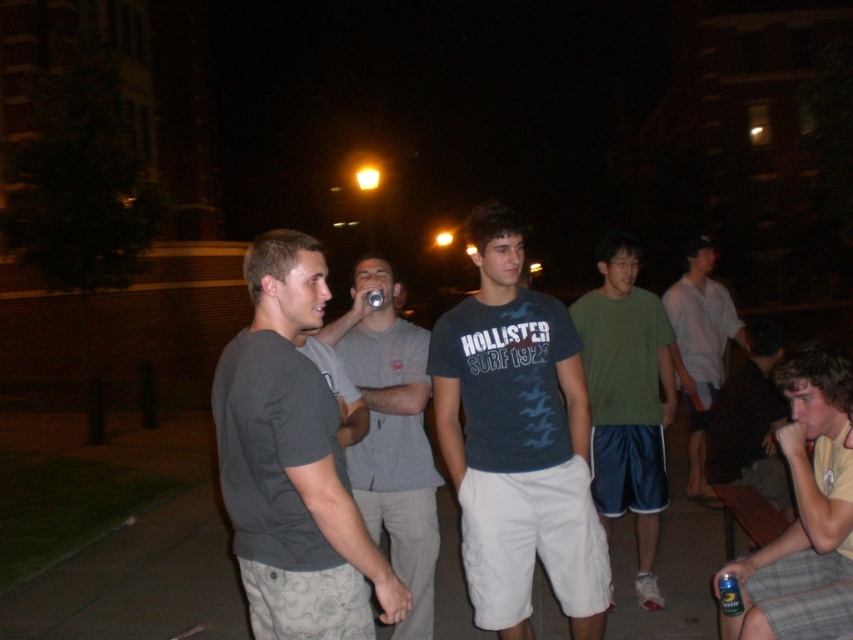
Question: Does yellow plaid shorts at lower right have a greater width compared to black striped shirt at lower right?

Choices:
 (A) yes
 (B) no

Answer: (B)

Question: Which point is closer to the camera taking this photo?

Choices:
 (A) (752, 609)
 (B) (276, 244)
 (C) (729, 337)

Answer: (B)

Question: Which object is positioned farthest from the white cotton shirt at right?

Choices:
 (A) gray cotton t-shirt at center
 (B) black striped shirt at lower right
 (C) yellow plaid shorts at lower right

Answer: (A)

Question: Which object is the farthest from the black striped shirt at lower right?

Choices:
 (A) gray cotton t-shirt at center
 (B) yellow plaid shorts at lower right
 (C) green fabric shirt at center

Answer: (A)

Question: In this image, where is dark blue t-shirt at center located relative to white cotton shirt at right?

Choices:
 (A) above
 (B) below

Answer: (A)

Question: Does dark blue t-shirt at center have a larger size compared to white cotton shirt at right?

Choices:
 (A) yes
 (B) no

Answer: (B)